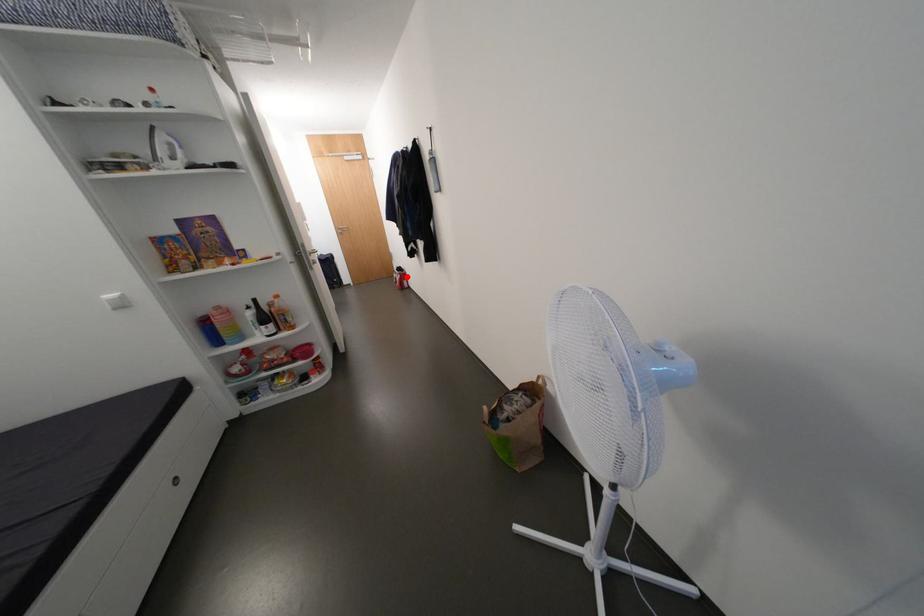
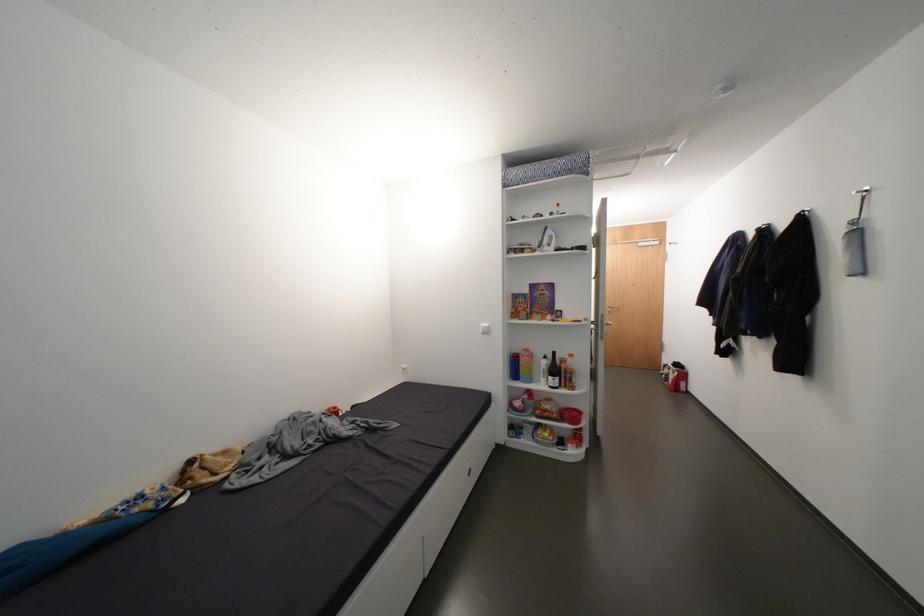
Question: I am providing you with two images of the same scene from different viewpoints. Image1 has a red point marked. In image2, the corresponding 3D location appears at what relative position? Reply with the corresponding letter.

Choices:
 (A) Closer
 (B) Farther

Answer: (A)